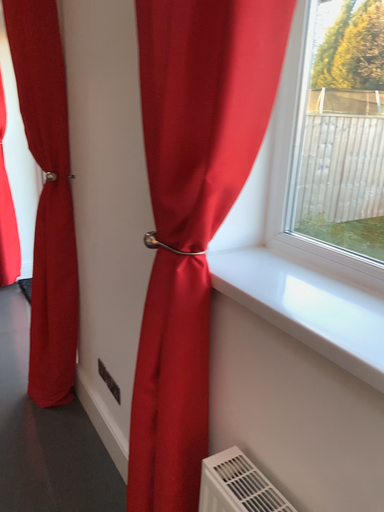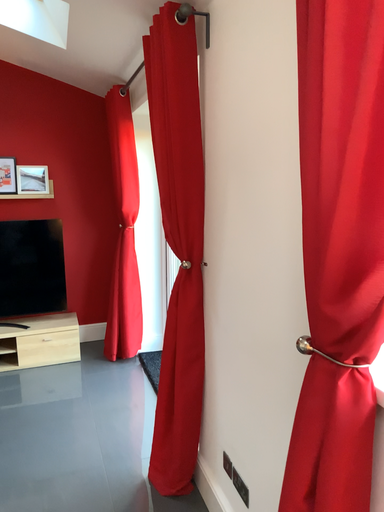
Question: Which way did the camera rotate in the video?

Choices:
 (A) rotated upward
 (B) rotated downward

Answer: (A)